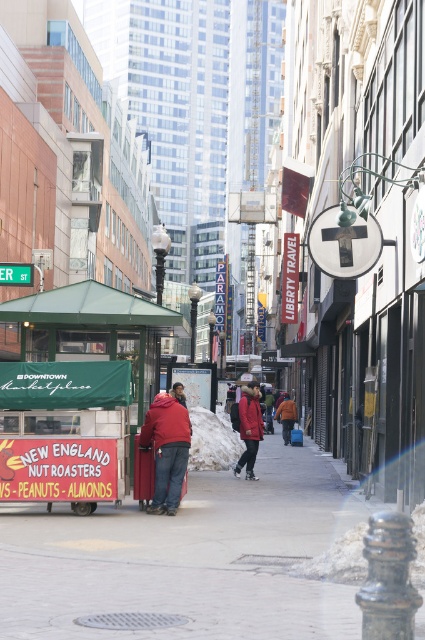
Question: Which is farther from the red jacket at center?

Choices:
 (A) green fabric cart at center
 (B) red woolen hat at center

Answer: (A)

Question: Is red jacket at center positioned in front of red woolen hat at center?

Choices:
 (A) yes
 (B) no

Answer: (A)

Question: Which object appears farthest from the camera in this image?

Choices:
 (A) red woolen hat at center
 (B) red jacket at center

Answer: (A)

Question: Is the position of red jacket at center less distant than that of red woolen hat at center?

Choices:
 (A) no
 (B) yes

Answer: (B)

Question: Which object is positioned farthest from the green fabric cart at center?

Choices:
 (A) red wool coat at center
 (B) red woolen hat at center
 (C) orange fuzzy jacket at center
 (D) brick pavement at center

Answer: (C)

Question: Does brick pavement at center appear on the right side of red jacket at center?

Choices:
 (A) no
 (B) yes

Answer: (B)